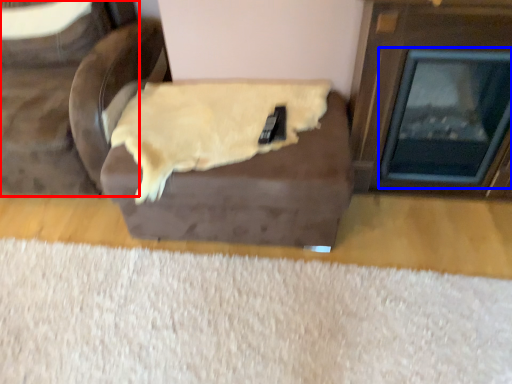
Question: Which object is closer to the camera taking this photo, furniture (highlighted by a red box) or fireplace (highlighted by a blue box)?

Choices:
 (A) furniture
 (B) fireplace

Answer: (B)